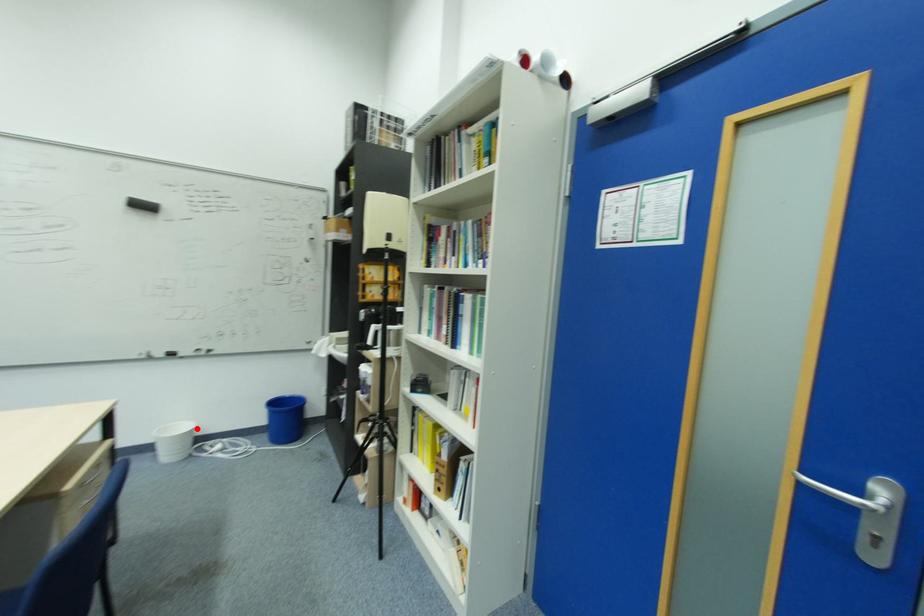
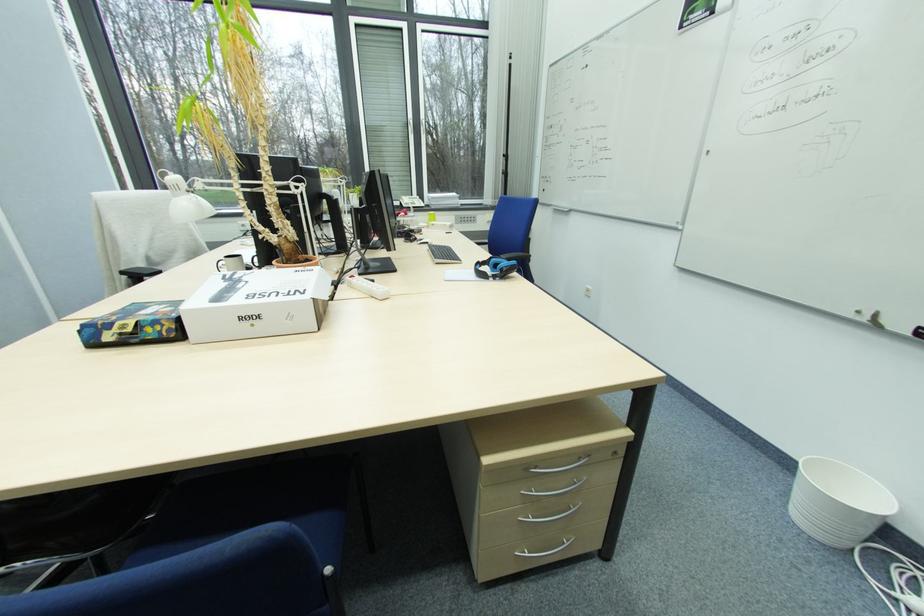
Question: I am providing you with two images of the same scene from different viewpoints. Given a red point in image1, look at the same physical point in image2. Is it:

Choices:
 (A) Closer to the viewpoint
 (B) Farther from the viewpoint

Answer: (B)